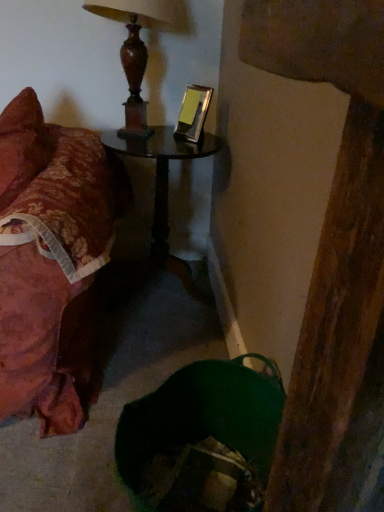
Question: Considering the positions of floral fabric bed at left and wooden lamp at upper center in the image, is floral fabric bed at left wider or thinner than wooden lamp at upper center?

Choices:
 (A) thin
 (B) wide

Answer: (B)

Question: From the image's perspective, is floral fabric bed at left positioned above or below wooden lamp at upper center?

Choices:
 (A) below
 (B) above

Answer: (A)

Question: Estimate the real-world distances between objects in this image. Which object is farther from the wooden lamp at upper center?

Choices:
 (A) black glass table at center
 (B) floral fabric bed at left

Answer: (B)

Question: Estimate the real-world distances between objects in this image. Which object is closer to the black glass table at center?

Choices:
 (A) floral fabric bed at left
 (B) wooden lamp at upper center

Answer: (B)